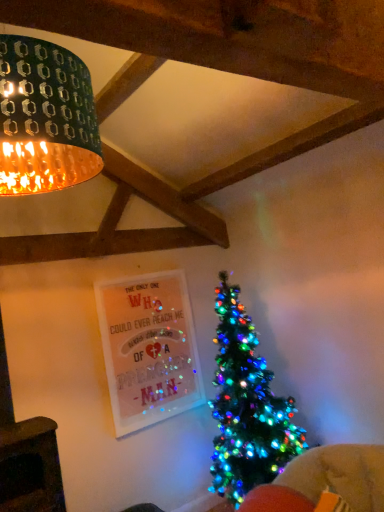
The image size is (384, 512). What are the coordinates of `green textured lampshade at upper left` in the screenshot? It's located at (45, 118).

What do you see at coordinates (45, 118) in the screenshot? I see `green textured lampshade at upper left` at bounding box center [45, 118].

The width and height of the screenshot is (384, 512). I want to click on green textured lampshade at upper left, so click(x=45, y=118).